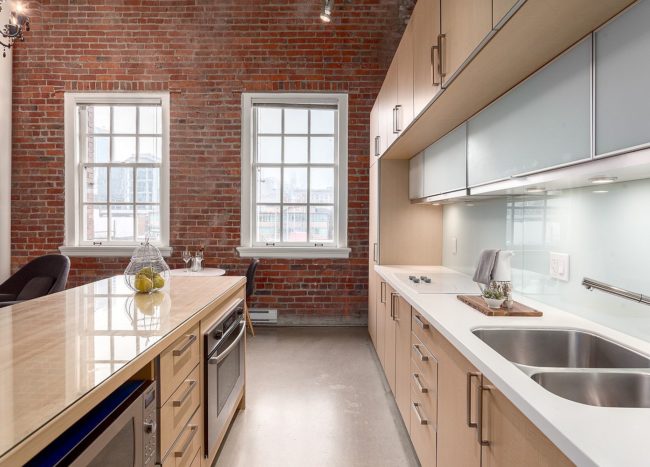
Where is `reflections of individual window panes on the countertop`? This screenshot has height=467, width=650. reflections of individual window panes on the countertop is located at coordinates (99, 373), (117, 366), (125, 346), (101, 344), (147, 342), (148, 322), (122, 315), (101, 315), (101, 286), (121, 282).